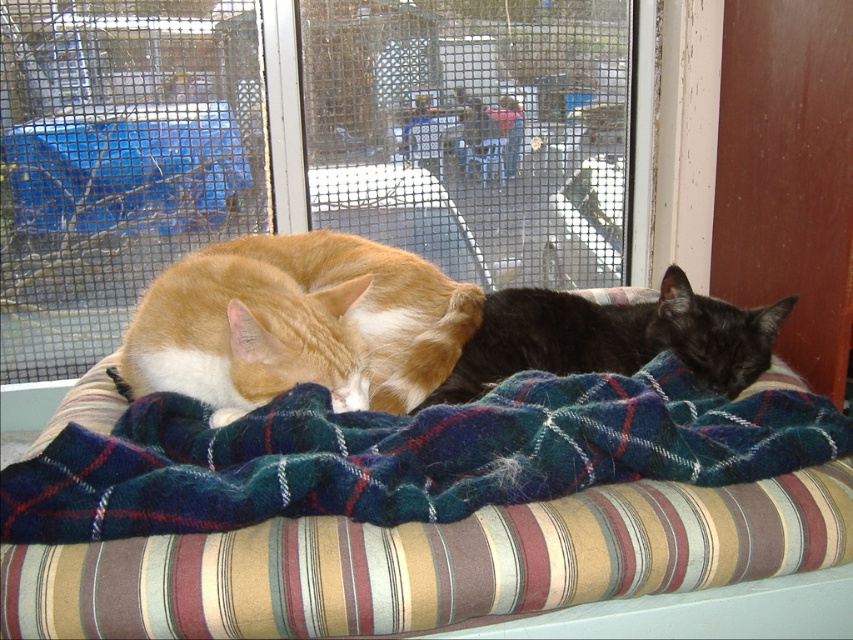
You are an AI analyzing the spatial arrangement of objects in an image. The scene shows a striped cushion with a plaid blanket and two cats. Where is the black silky cat at center located in 2D coordinates?

The black silky cat at center is located at the 2D coordinates point (613, 337).

You are taking a photo of the two cats on the cushion. You want to focus on the cat that is closer to the camera. Which point should you focus on, point (824, 314) or point (476, 342)?

Point (476, 342) is closer to the camera than point (824, 314), so you should focus on point (476, 342) to capture the cat closer to the camera.